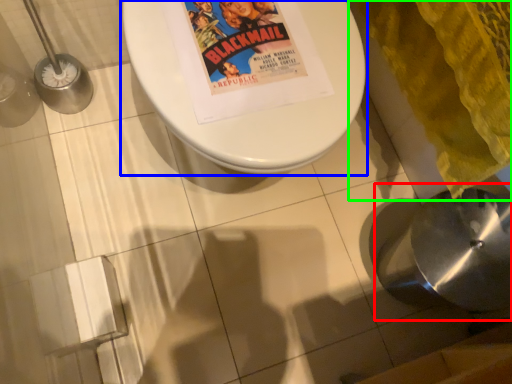
Question: Based on their relative distances, which object is nearer to sink (highlighted by a red box)? Choose from toilet (highlighted by a blue box) and blanket (highlighted by a green box).

Choices:
 (A) toilet
 (B) blanket

Answer: (B)